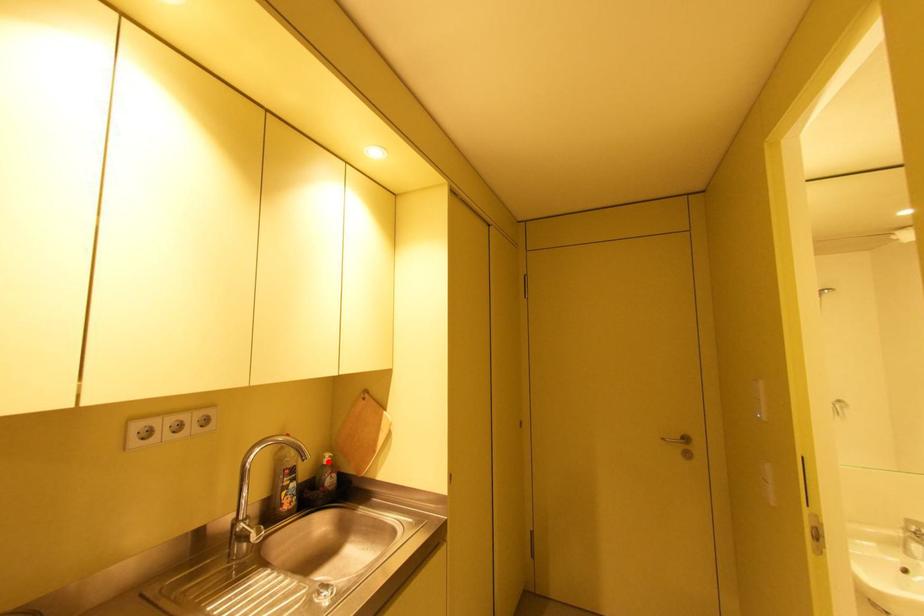
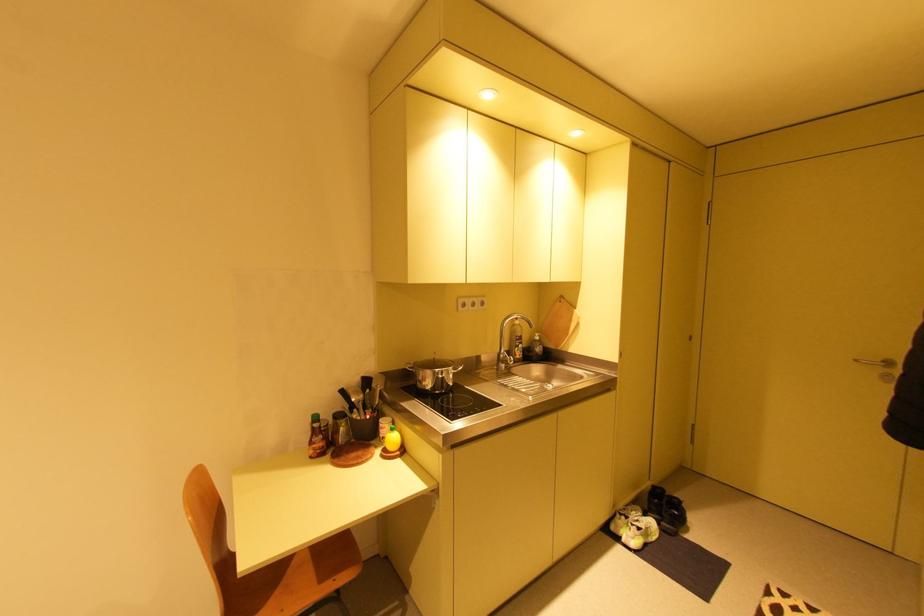
Where in the second image is the point corresponding to the highlighted location from the first image?

(541, 339)